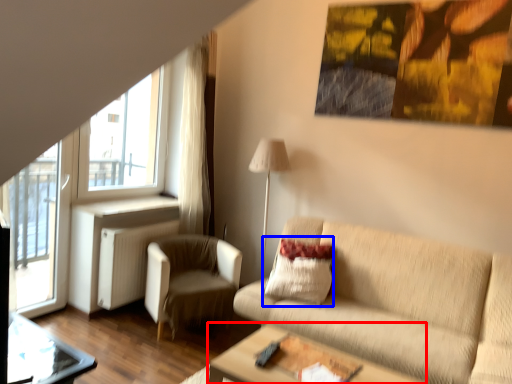
Question: Which object appears closest to the camera in this image, table (highlighted by a red box) or pillow (highlighted by a blue box)?

Choices:
 (A) table
 (B) pillow

Answer: (A)